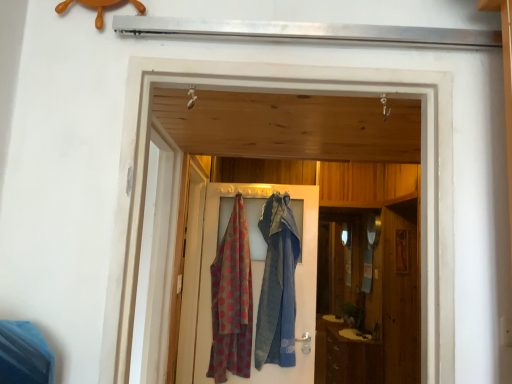
Question: Considering the relative positions of polka dot fabric at center and polka dot fabric at center in the image provided, is polka dot fabric at center to the left or to the right of polka dot fabric at center?

Choices:
 (A) left
 (B) right

Answer: (B)

Question: From the image's perspective, is polka dot fabric at center located above or below polka dot fabric at center?

Choices:
 (A) above
 (B) below

Answer: (A)

Question: Which is farther from the polka dot fabric at center?

Choices:
 (A) white glossy screen door at upper center, positioned as the 1th screen door in front-to-back order
 (B) wooden screen door at center, the 1th screen door from the back
 (C) polka dot fabric at center
 (D) brown wood cabinet at lower right

Answer: (D)

Question: Based on their relative distances, which object is nearer to the wooden screen door at center, which appears as the second screen door when viewed from the front?

Choices:
 (A) white glossy screen door at upper center, positioned as the 1th screen door in front-to-back order
 (B) polka dot fabric at center
 (C) polka dot fabric at center
 (D) brown wood cabinet at lower right

Answer: (B)